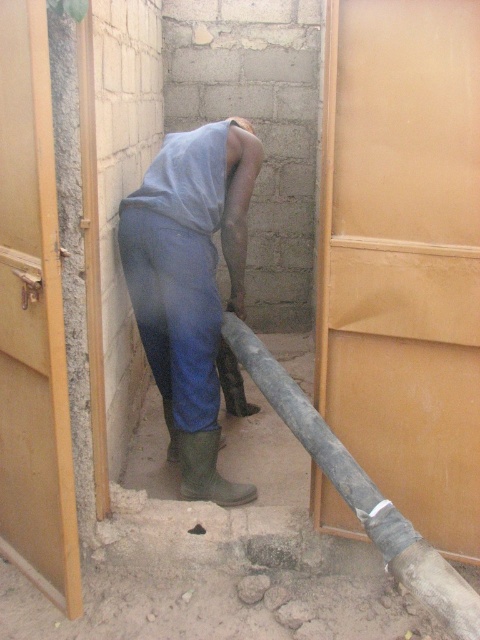
Does point (191, 490) lie behind point (204, 529)?

Yes, it is.

Who is shorter, green rubber boot at lower center or smooth concrete hole at lower center?

smooth concrete hole at lower center is shorter.

Which is in front, point (182, 481) or point (192, 531)?

Point (192, 531) is more forward.

Locate an element on the screen. This screenshot has height=640, width=480. green rubber boot at lower center is located at coordinates (207, 470).

Can you confirm if rusty metallic pipe at center is thinner than green rubber boot at lower center?

In fact, rusty metallic pipe at center might be wider than green rubber boot at lower center.

Which is more to the right, rusty metallic pipe at center or green rubber boot at lower center?

Positioned to the right is rusty metallic pipe at center.

Find the location of a particular element. rusty metallic pipe at center is located at coordinates (360, 492).

This screenshot has height=640, width=480. I want to click on rusty metallic pipe at center, so click(360, 492).

Can you confirm if rusty metallic pipe at center is positioned to the left of smooth concrete hole at lower center?

In fact, rusty metallic pipe at center is to the right of smooth concrete hole at lower center.

Measure the distance between rusty metallic pipe at center and camera.

rusty metallic pipe at center and camera are 6.25 feet apart from each other.

Locate an element on the screen. rusty metallic pipe at center is located at coordinates (360, 492).